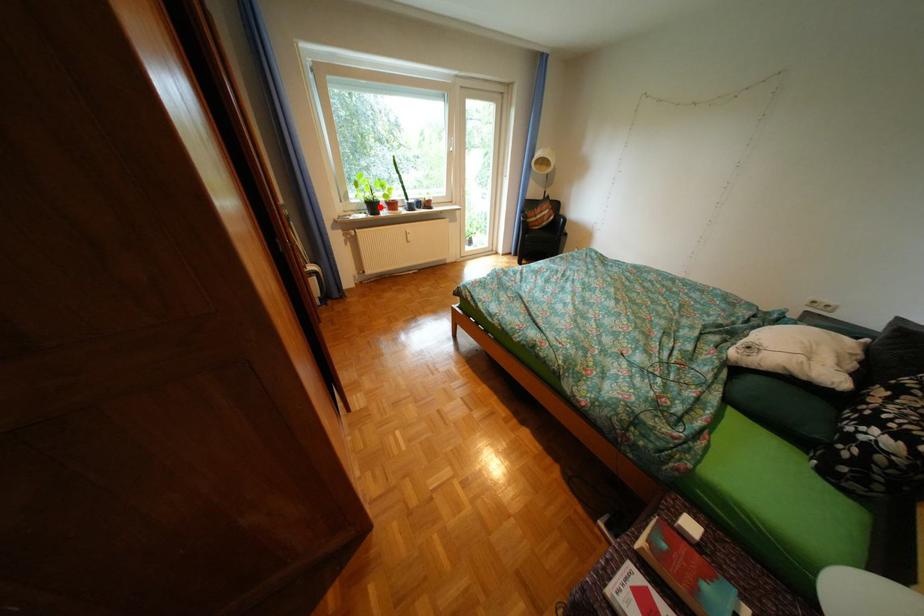
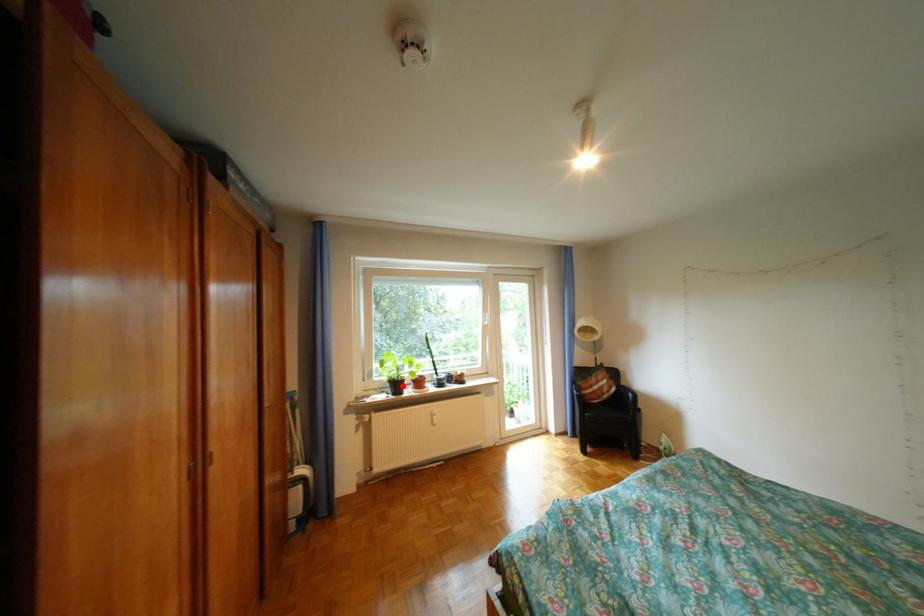
I am providing you with two images of the same scene from different viewpoints. A red point is marked on the first image and another point is marked on the second image. Is the red point in image1 aligned with the point shown in image2?

Yes